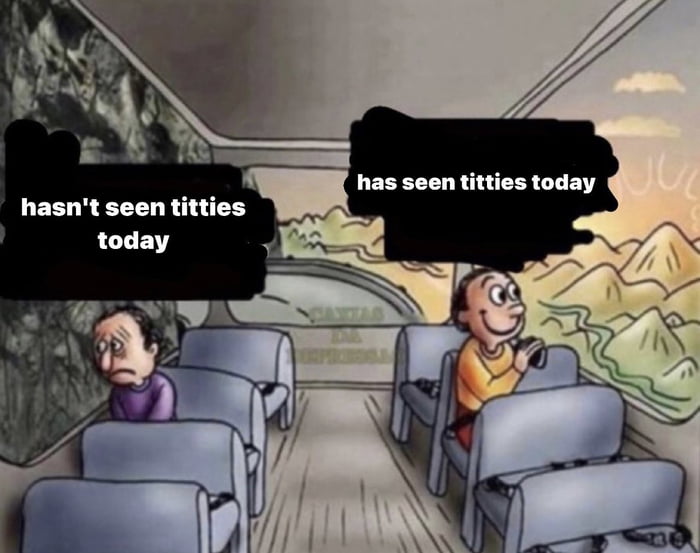
The image size is (700, 553). I want to click on seats, so click(113, 516), click(204, 457), click(223, 405), click(245, 363), click(411, 348), click(442, 410), click(498, 425), click(598, 505).